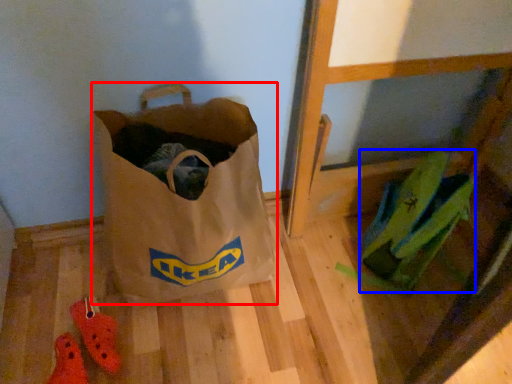
Question: Which point is further to the camera, luggage and bags (highlighted by a red box) or grocery bag (highlighted by a blue box)?

Choices:
 (A) luggage and bags
 (B) grocery bag

Answer: (B)